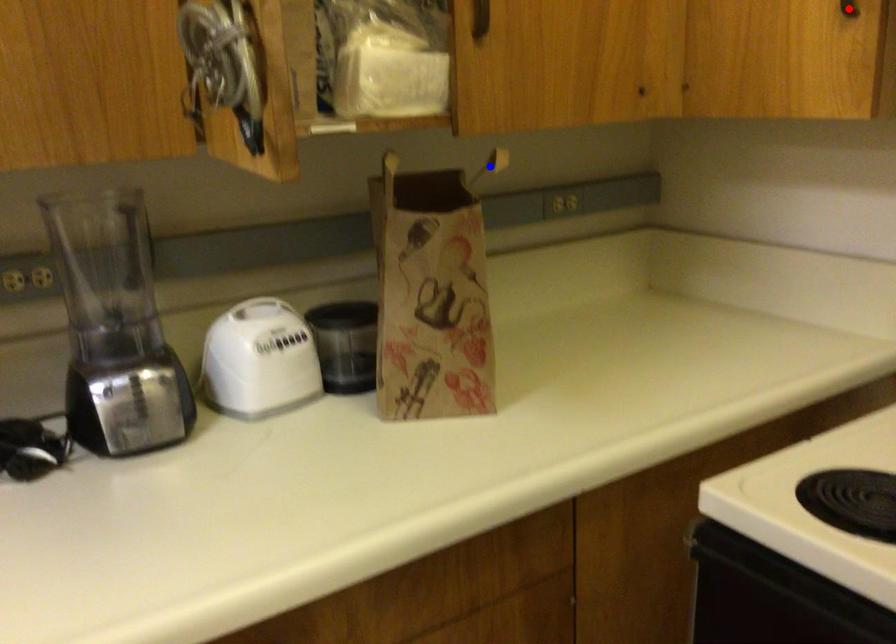
Question: In the image, two points are highlighted. Which point is nearer to the camera? Reply with the corresponding letter.

Choices:
 (A) blue point
 (B) red point

Answer: (B)